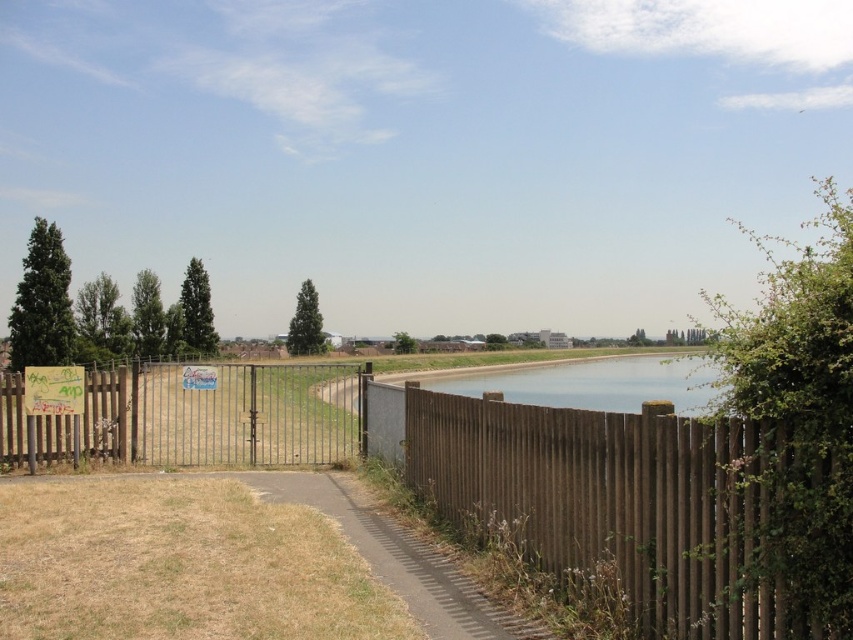
Does point (660, 499) lie behind point (387, 560)?

No, it is in front of (387, 560).

Can you confirm if brown wooden fence at right is positioned to the left of brown textured path at lower center?

In fact, brown wooden fence at right is to the right of brown textured path at lower center.

Where is `brown wooden fence at right`? brown wooden fence at right is located at coordinates (653, 508).

In order to click on brown wooden fence at right in this screenshot , I will do `click(653, 508)`.

Is brown wooden fence at left smaller than clear water at center?

Correct, brown wooden fence at left occupies less space than clear water at center.

Who is lower down, brown wooden fence at left or clear water at center?

Positioned lower is clear water at center.

I want to click on brown wooden fence at left, so click(194, 417).

Is point (711, 636) farther from viewer compared to point (590, 406)?

No, (711, 636) is in front of (590, 406).

Is brown wooden fence at right positioned before clear water at center?

Yes, brown wooden fence at right is closer to the viewer.

Between point (704, 536) and point (628, 381), which one is positioned behind?

The point (628, 381) is behind.

Where is `brown wooden fence at right`? Image resolution: width=853 pixels, height=640 pixels. brown wooden fence at right is located at coordinates (653, 508).